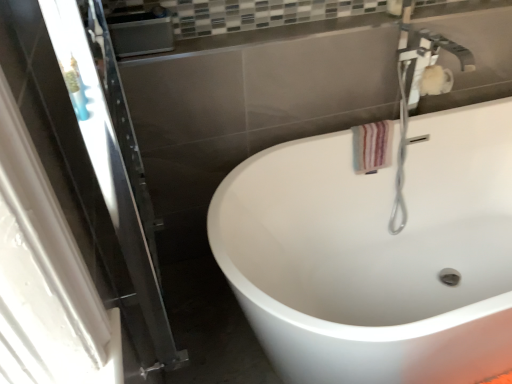
Question: Does white glossy bathtub at center have a smaller size compared to striped fabric hand towel at upper right?

Choices:
 (A) no
 (B) yes

Answer: (A)

Question: Is the position of white glossy bathtub at center less distant than that of striped fabric hand towel at upper right?

Choices:
 (A) yes
 (B) no

Answer: (A)

Question: Can you confirm if white glossy bathtub at center is bigger than striped fabric hand towel at upper right?

Choices:
 (A) yes
 (B) no

Answer: (A)

Question: Is white glossy bathtub at center to the right of striped fabric hand towel at upper right from the viewer's perspective?

Choices:
 (A) yes
 (B) no

Answer: (A)

Question: Does white glossy bathtub at center appear on the left side of striped fabric hand towel at upper right?

Choices:
 (A) no
 (B) yes

Answer: (A)

Question: Considering their positions, is transparent glass screen door at left located in front of or behind white glossy bathtub at center?

Choices:
 (A) front
 (B) behind

Answer: (A)

Question: From a real-world perspective, relative to white glossy bathtub at center, is transparent glass screen door at left vertically above or below?

Choices:
 (A) above
 (B) below

Answer: (A)

Question: Is transparent glass screen door at left bigger or smaller than white glossy bathtub at center?

Choices:
 (A) big
 (B) small

Answer: (B)

Question: Considering the relative positions of transparent glass screen door at left and white glossy bathtub at center in the image provided, is transparent glass screen door at left to the left or to the right of white glossy bathtub at center?

Choices:
 (A) right
 (B) left

Answer: (B)

Question: In terms of size, does striped fabric hand towel at upper right appear bigger or smaller than white glossy faucet at upper right?

Choices:
 (A) small
 (B) big

Answer: (A)

Question: From the image's perspective, is striped fabric hand towel at upper right positioned above or below white glossy faucet at upper right?

Choices:
 (A) above
 (B) below

Answer: (B)

Question: Is point (359, 160) positioned closer to the camera than point (399, 178)?

Choices:
 (A) closer
 (B) farther

Answer: (A)

Question: Is striped fabric hand towel at upper right inside or outside of white glossy faucet at upper right?

Choices:
 (A) outside
 (B) inside

Answer: (A)

Question: In the image, is striped fabric hand towel at upper right positioned in front of or behind white glossy bathtub at center?

Choices:
 (A) front
 (B) behind

Answer: (B)

Question: From the image's perspective, is striped fabric hand towel at upper right above or below white glossy bathtub at center?

Choices:
 (A) below
 (B) above

Answer: (B)